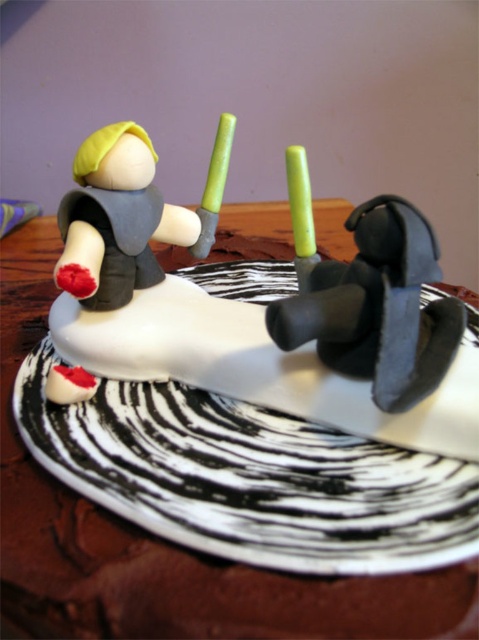
Question: Estimate the real-world distances between objects in this image. Which object is farther from the green wax candle at center?

Choices:
 (A) matte black propeller at center
 (B) green plastic candle at center

Answer: (A)

Question: Which point is closer to the camera?

Choices:
 (A) green plastic candle at center
 (B) matte black propeller at center
 (C) matte gray figure at upper left
 (D) green wax candle at center

Answer: (B)

Question: Which of the following is the closest to the observer?

Choices:
 (A) (308, 260)
 (B) (78, 276)
 (C) (209, 211)
 (D) (366, 225)

Answer: (D)

Question: Does matte gray figure at upper left appear under green plastic candle at center?

Choices:
 (A) no
 (B) yes

Answer: (B)

Question: Does matte gray figure at upper left appear on the left side of green wax candle at center?

Choices:
 (A) yes
 (B) no

Answer: (A)

Question: Is matte black propeller at center behind matte gray figure at upper left?

Choices:
 (A) no
 (B) yes

Answer: (A)